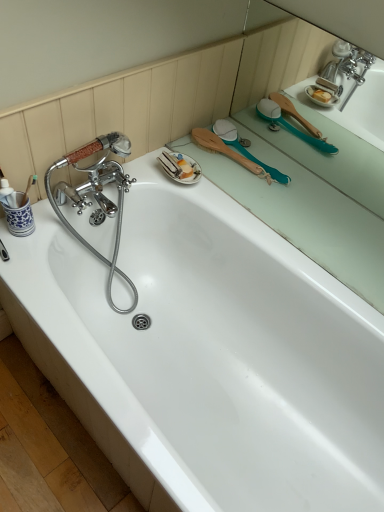
Locate an element on the screen. vacant point above teal rubber brush at upper right, the first mirror ordered from the bottom (from a real-world perspective) is located at coordinates (306, 199).